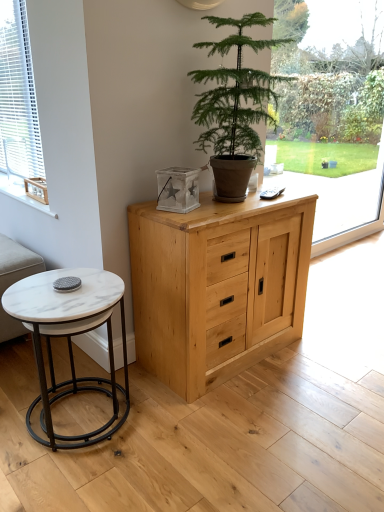
Locate an element on the screen. free spot below white marble coffee table at lower left (from a real-world perspective) is located at coordinates (76, 418).